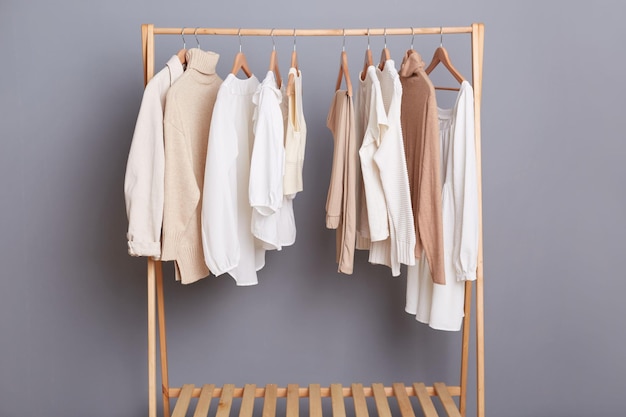
Identify the location of hanger. (182, 30), (198, 40), (237, 60), (274, 56), (294, 55), (346, 63), (367, 51), (382, 50), (414, 51), (446, 58).